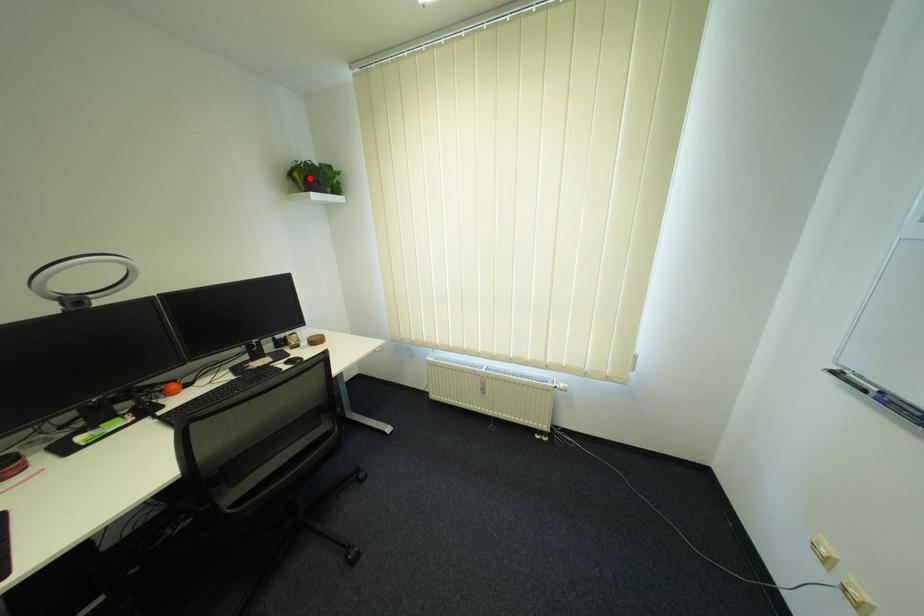
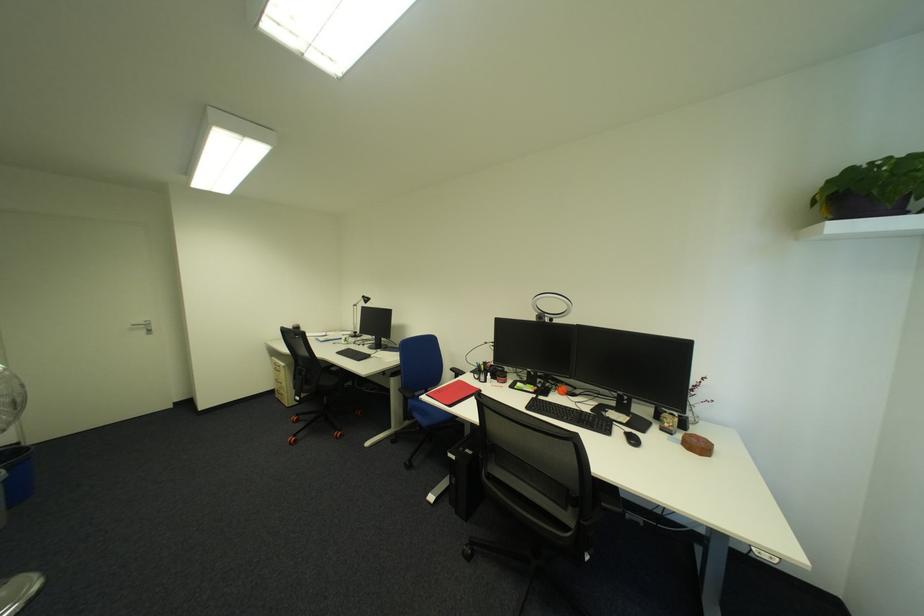
Find the pixel in the second image that matches the highlighted location in the first image.

(831, 200)